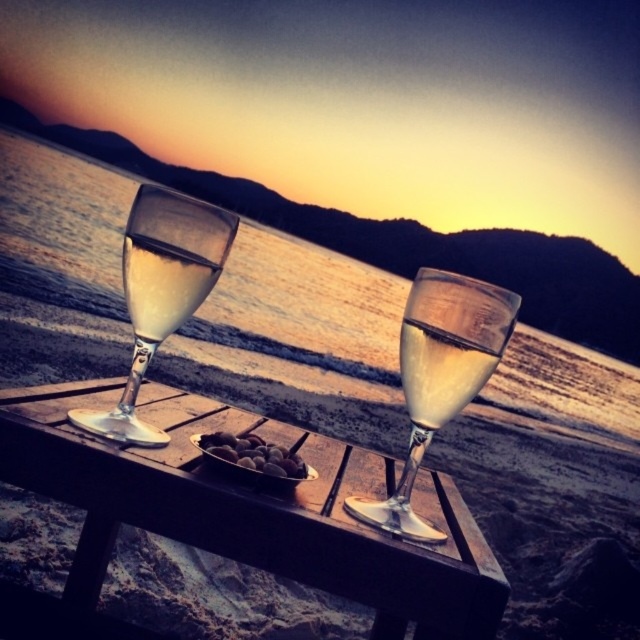
Question: Does clear glass wine at center appear under brown matte nuts at center?

Choices:
 (A) yes
 (B) no

Answer: (B)

Question: Considering the relative positions of matte glass at left and brown matte nuts at center in the image provided, where is matte glass at left located with respect to brown matte nuts at center?

Choices:
 (A) below
 (B) above

Answer: (B)

Question: Which point is closer to the camera taking this photo?

Choices:
 (A) coord(68,392)
 (B) coord(408,406)
 (C) coord(264,445)
 (D) coord(156,282)

Answer: (D)

Question: Does transparent glass water at center have a greater width compared to clear glass wine glass at center?

Choices:
 (A) no
 (B) yes

Answer: (B)

Question: Which object is closer to the camera taking this photo?

Choices:
 (A) clear glass wine glass at left
 (B) wooden table at center

Answer: (B)

Question: Which point is farther to the camera?

Choices:
 (A) (380, 632)
 (B) (300, 477)
 (C) (172, 253)
 (D) (566, 387)

Answer: (D)